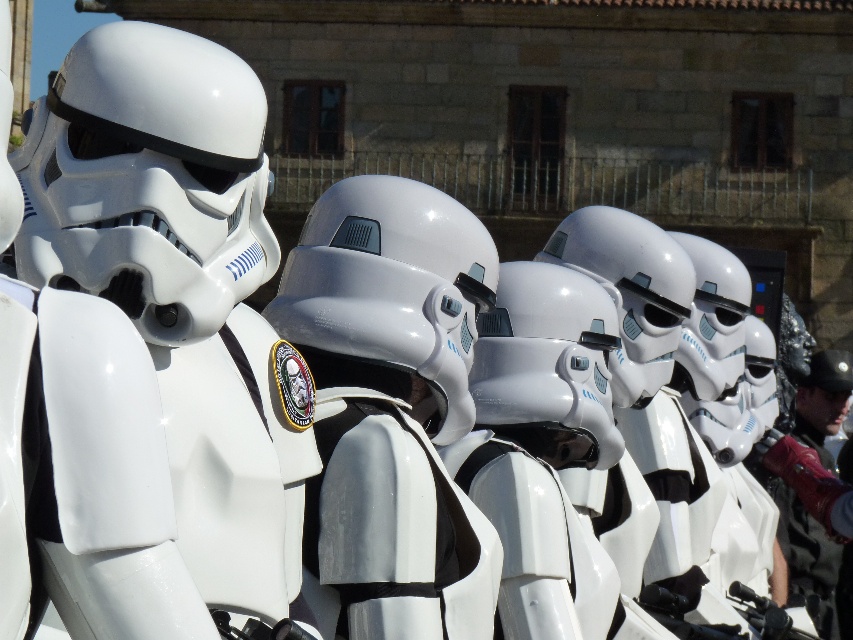
You are a costume designer examining the stormtrooper helmets in the image. You need to determine which helmet has a larger size between the matte white helmet at left and the glossy white helmet at center. Which one is bigger?

The matte white helmet at left has a larger size compared to the glossy white helmet at center, so the matte white helmet at left is bigger.

You are a photographer at the event and want to capture a photo that includes both the matte white helmet at left and the glossy white helmet at center. Based on their positions, which helmet should you position on the left side of your photo?

The matte white helmet at left should be positioned on the left side of the photo since it is to the left of the glossy white helmet at center.